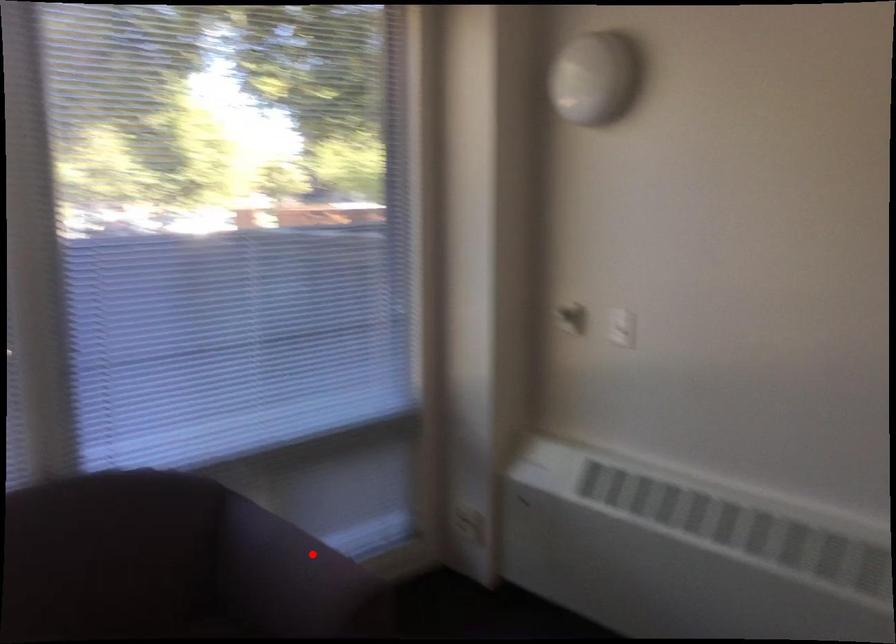
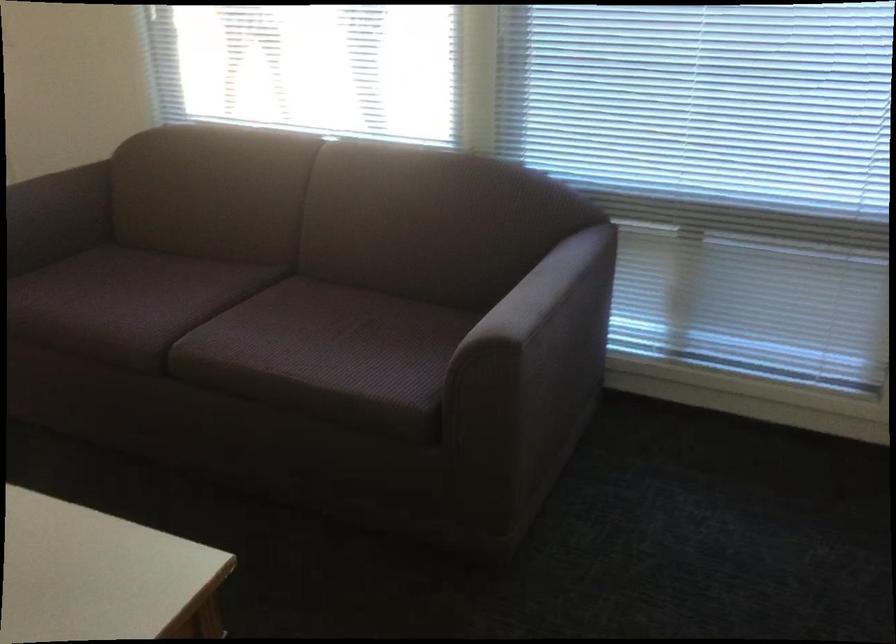
Where in the second image is the point corresponding to the highlighted location from the first image?

(545, 294)